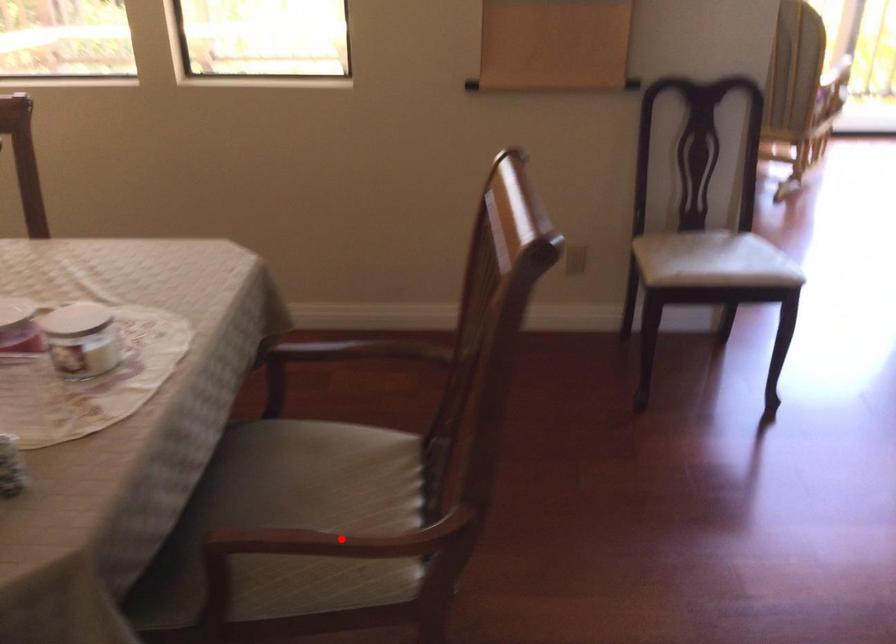
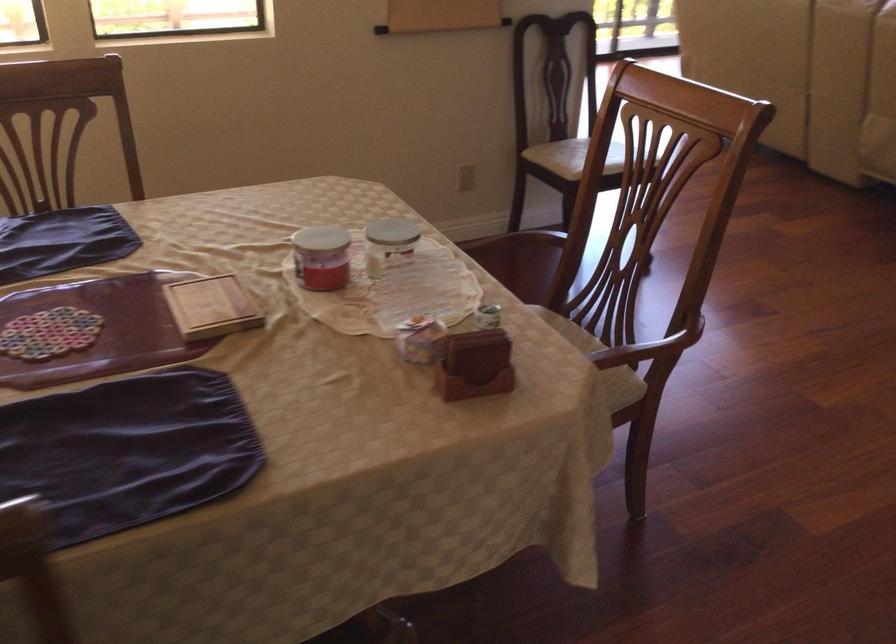
Question: I am providing you with two images of the same scene from different viewpoints. Given a red point in image1, look at the same physical point in image2. Is it:

Choices:
 (A) Closer to the viewpoint
 (B) Farther from the viewpoint

Answer: (B)